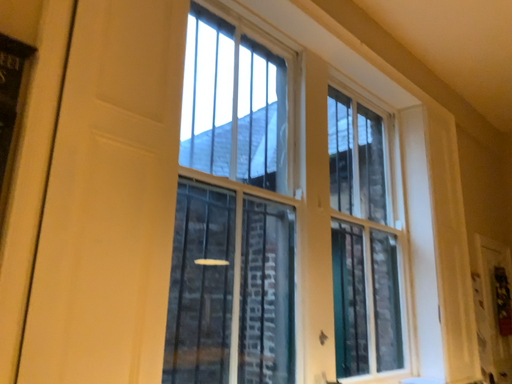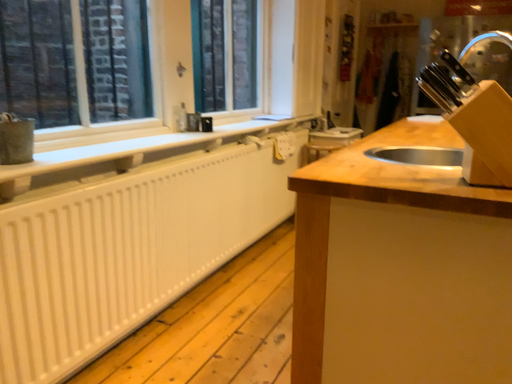
Question: How did the camera likely rotate when shooting the video?

Choices:
 (A) rotated left
 (B) rotated right

Answer: (B)